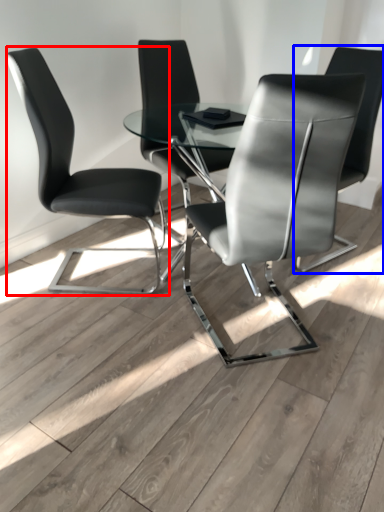
Question: Which of the following is the farthest to the observer, chair (highlighted by a red box) or chair (highlighted by a blue box)?

Choices:
 (A) chair
 (B) chair

Answer: (B)